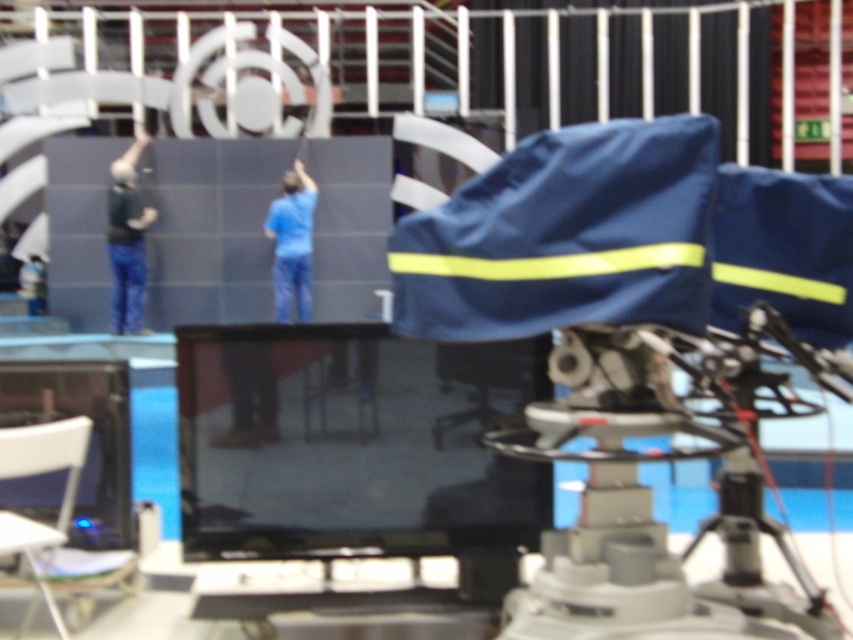
Question: Does dark blue jeans at left come behind blue matte shirt at center?

Choices:
 (A) yes
 (B) no

Answer: (A)

Question: Does dark blue jeans at left appear over blue matte shirt at center?

Choices:
 (A) yes
 (B) no

Answer: (A)

Question: Which object is farther from the camera taking this photo?

Choices:
 (A) blue matte shirt at center
 (B) metallic tripod at center

Answer: (A)

Question: Which object appears farthest from the camera in this image?

Choices:
 (A) dark blue jeans at left
 (B) blue matte shirt at center
 (C) metallic tripod at center

Answer: (A)

Question: Can you confirm if metallic tripod at center is wider than dark blue jeans at left?

Choices:
 (A) no
 (B) yes

Answer: (B)

Question: Estimate the real-world distances between objects in this image. Which object is closer to the metallic tripod at center?

Choices:
 (A) dark blue jeans at left
 (B) blue matte shirt at center

Answer: (B)